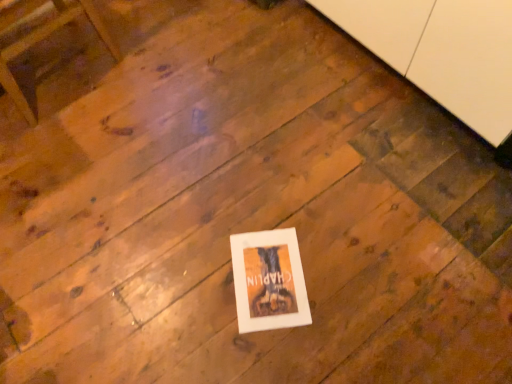
Where is `free space behind white paper at center`? The image size is (512, 384). free space behind white paper at center is located at coordinates (259, 204).